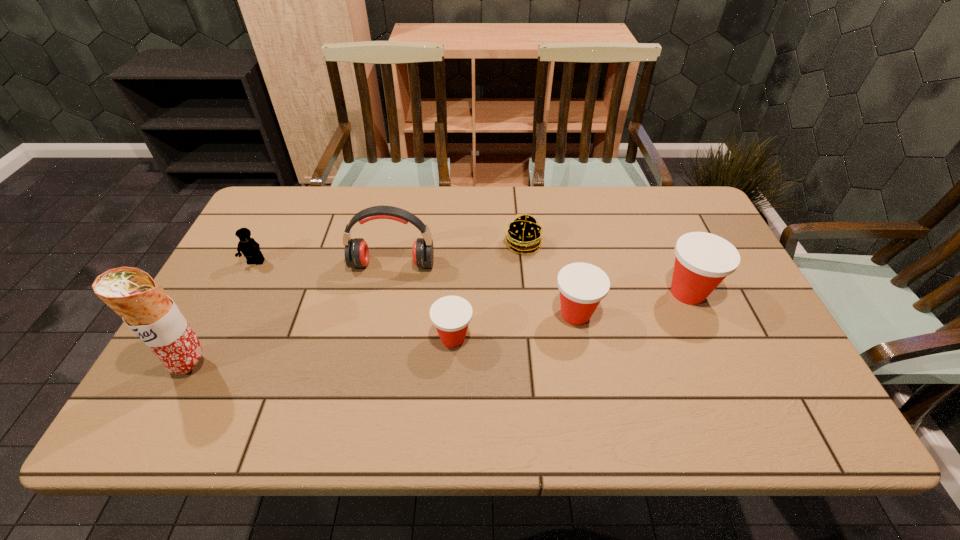
Image resolution: width=960 pixels, height=540 pixels. Find the location of `blank space located 0.200m on the right of the shortest Dixie cup`. blank space located 0.200m on the right of the shortest Dixie cup is located at coordinates (556, 338).

The image size is (960, 540). I want to click on free space located on the front of the second Dixie cup from right to left, so click(x=584, y=358).

Identify the location of free space located on the back of the tallest Dixie cup. (657, 223).

This screenshot has height=540, width=960. Find the location of `free location located 0.090m on the front-facing side of the Lego`. free location located 0.090m on the front-facing side of the Lego is located at coordinates click(241, 292).

Where is `free space located 0.120m on the left of the patty`? This screenshot has width=960, height=540. free space located 0.120m on the left of the patty is located at coordinates (463, 244).

The height and width of the screenshot is (540, 960). Find the location of `free location located 0.320m on the ear cups of the second tallest object`. free location located 0.320m on the ear cups of the second tallest object is located at coordinates (371, 375).

This screenshot has height=540, width=960. Identify the location of vacant space located on the right of the burrito. (342, 364).

The height and width of the screenshot is (540, 960). Identify the location of object at the far edge. (523, 235).

Locate an element on the screen. object that is at the near edge is located at coordinates (132, 293).

You are a GUI agent. You are given a task and a screenshot of the screen. Output one action in this format:
    pyautogui.click(x=<x>, y=<y>)
    Task: Click on the Lego that is positioned at the left edge
    This screenshot has height=540, width=960.
    Given the screenshot: What is the action you would take?
    pyautogui.click(x=248, y=246)